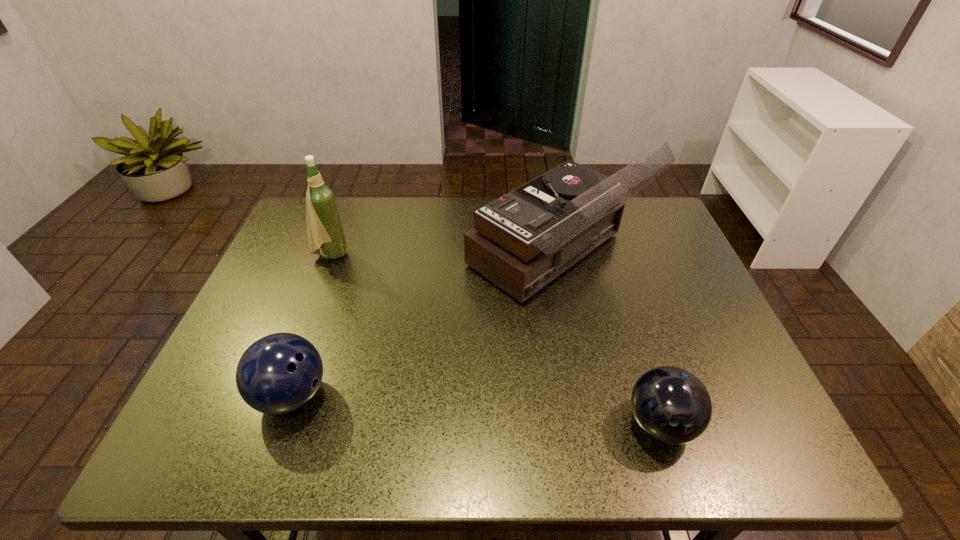
At what (x,y) coordinates should I click in order to perform the action: click on blank region between the wine bottle and the left bowling ball. Please return your answer as a coordinate pair (x, y). Looking at the image, I should click on (312, 325).

This screenshot has height=540, width=960. Find the location of `empty location between the left bowling ball and the right bowling ball`. empty location between the left bowling ball and the right bowling ball is located at coordinates (476, 409).

At what (x,y) coordinates should I click in order to perform the action: click on free space between the record player and the right bowling ball. Please return your answer as a coordinate pair (x, y). The height and width of the screenshot is (540, 960). Looking at the image, I should click on (608, 340).

Find the location of a particular element. The image size is (960, 540). free spot between the right bowling ball and the wine bottle is located at coordinates (495, 339).

Where is `vacant area that lies between the left bowling ball and the wine bottle`? vacant area that lies between the left bowling ball and the wine bottle is located at coordinates (312, 325).

At what (x,y) coordinates should I click in order to perform the action: click on free space between the right bowling ball and the left bowling ball. Please return your answer as a coordinate pair (x, y). Looking at the image, I should click on (476, 409).

Where is `free space between the wine bottle and the right bowling ball`? Image resolution: width=960 pixels, height=540 pixels. free space between the wine bottle and the right bowling ball is located at coordinates (495, 339).

Where is `vacant area between the record player and the wine bottle`? This screenshot has height=540, width=960. vacant area between the record player and the wine bottle is located at coordinates (443, 255).

In order to click on free point between the wine bottle and the right bowling ball in this screenshot , I will do `click(495, 339)`.

You are a GUI agent. You are given a task and a screenshot of the screen. Output one action in this format:
    pyautogui.click(x=<x>, y=<y>)
    Task: Click on the free spot between the wine bottle and the left bowling ball
    The height and width of the screenshot is (540, 960).
    Given the screenshot: What is the action you would take?
    pyautogui.click(x=312, y=325)